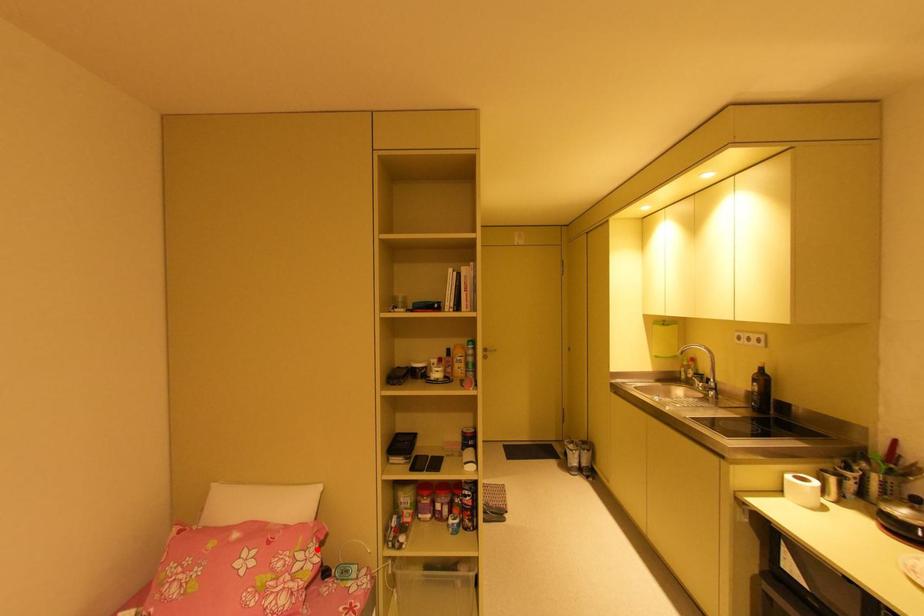
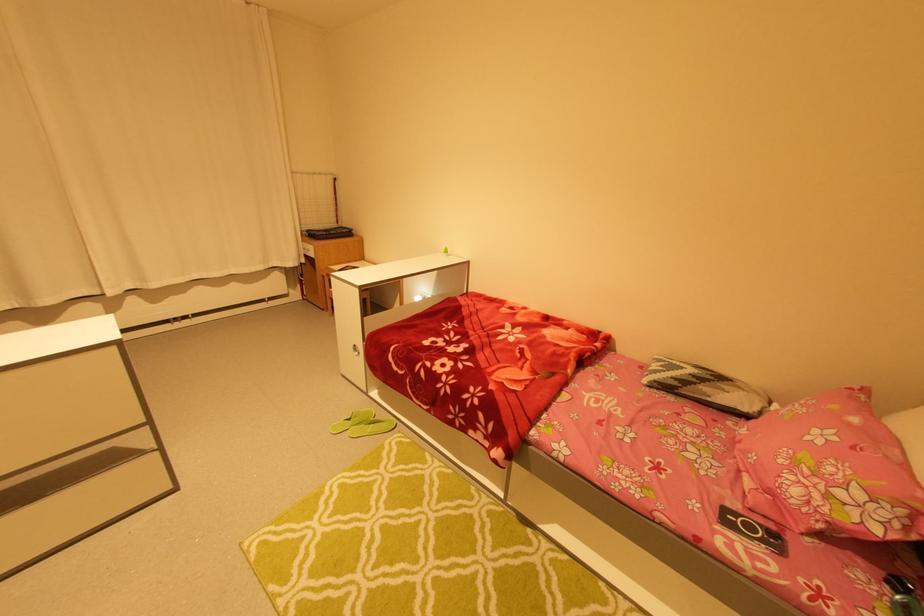
Find the pixel in the second image that matches the highlighted location in the first image.

(891, 515)